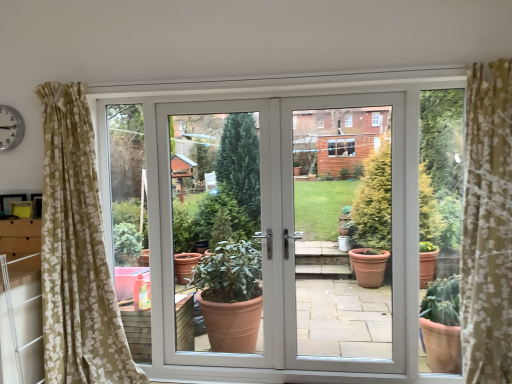
Question: From the image's perspective, is white plastic clock at upper left located above or below white plastic screen door at center?

Choices:
 (A) above
 (B) below

Answer: (A)

Question: Does point click(x=12, y=115) appear closer or farther from the camera than point click(x=304, y=299)?

Choices:
 (A) farther
 (B) closer

Answer: (B)

Question: Considering the real-world distances, which object is closest to the white glossy door at center?

Choices:
 (A) white plastic clock at upper left
 (B) white plastic screen door at center

Answer: (B)

Question: Based on their relative distances, which object is farther from the white plastic clock at upper left?

Choices:
 (A) white glossy door at center
 (B) white plastic screen door at center

Answer: (B)